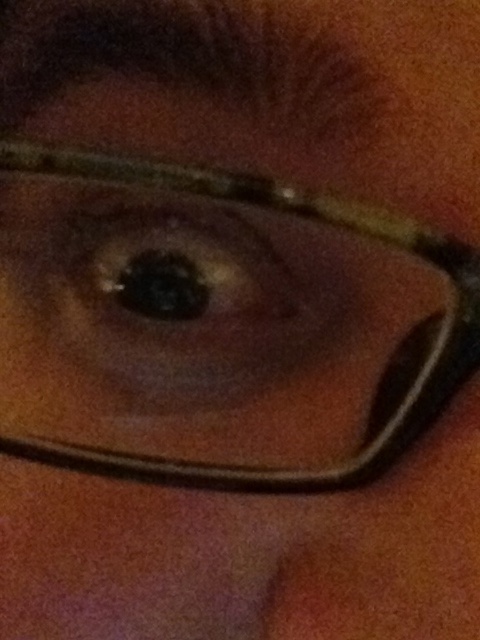
Does matte brown glasses at center appear on the left side of brown matte eye at center?

No, matte brown glasses at center is not to the left of brown matte eye at center.

Does point (96, 164) come closer to viewer compared to point (208, 324)?

Yes.

Between point (250, 196) and point (227, 241), which one is positioned in front?

Point (250, 196) is in front.

Locate an element on the screen. The height and width of the screenshot is (640, 480). matte brown glasses at center is located at coordinates (323, 221).